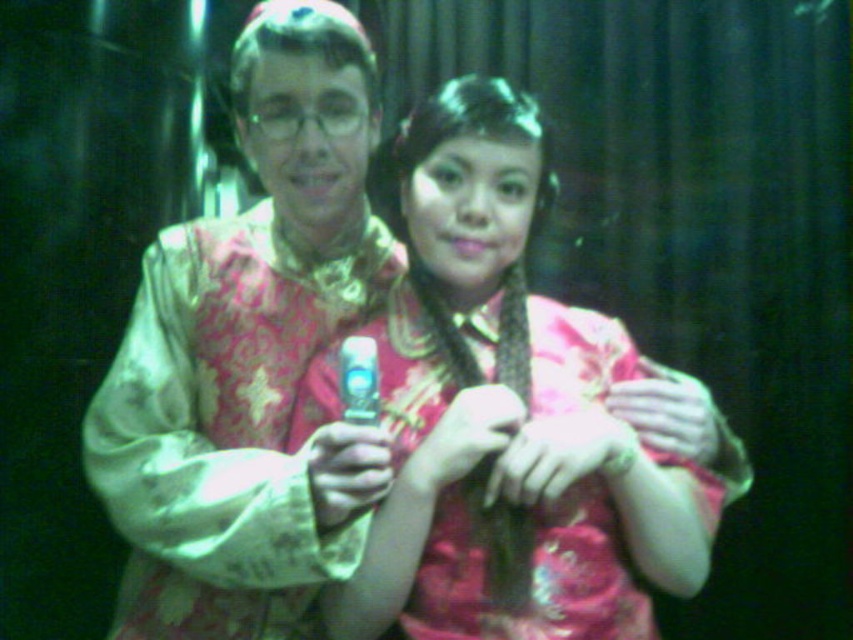
You are a photographer who needs to adjust the lighting between the pink satin dress at center and the shiny metallic phone at center. Since the phone reflects light more, which object should you focus the light on to ensure both are visible?

The pink satin dress at center is 6.25 inches from shiny metallic phone at center. To ensure both are visible, focus the light on the shiny metallic phone at center since it reflects light more and requires less direct illumination to appear bright.

You are a photographer setting up for a photoshoot. You notice the pink satin dress at center and the shiny metallic phone at center in the frame. Which object should you adjust to ensure both are clearly visible, and why?

The pink satin dress at center is larger in size than the shiny metallic phone at center, so you should adjust the position of the pink satin dress at center to ensure both objects are clearly visible in the frame.

You are an assistant who needs to locate the pink satin dress at center in the image. Based on the coordinates provided, can you determine its exact location relative to the center of the image?

The pink satin dress at center is located at coordinates point (508, 410), which means it is slightly to the right and slightly below the exact center of the image.